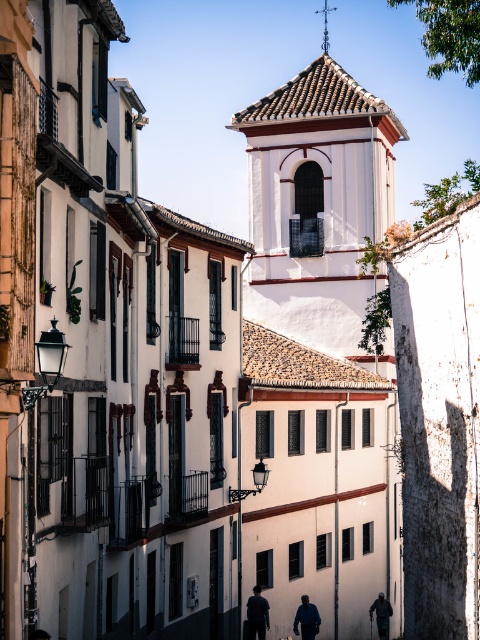
Is white textured tower at center to the right of dark blue jacket at center from the viewer's perspective?

Indeed, white textured tower at center is positioned on the right side of dark blue jacket at center.

Is white textured tower at center wider than dark blue jacket at center?

Yes.

The height and width of the screenshot is (640, 480). Find the location of `white textured tower at center`. white textured tower at center is located at coordinates (321, 346).

Which is above, dark blue fabric at center or dark blue jacket at center?

dark blue fabric at center is higher up.

Can you confirm if dark blue fabric at center is smaller than dark blue jacket at center?

Incorrect, dark blue fabric at center is not smaller in size than dark blue jacket at center.

Image resolution: width=480 pixels, height=640 pixels. Describe the element at coordinates (256, 614) in the screenshot. I see `dark blue fabric at center` at that location.

This screenshot has height=640, width=480. Identify the location of dark blue fabric at center. (256, 614).

Does white textured tower at center appear under dark blue fabric at center?

Actually, white textured tower at center is above dark blue fabric at center.

In the scene shown: Can you confirm if white textured tower at center is wider than dark blue fabric at center?

Indeed, white textured tower at center has a greater width compared to dark blue fabric at center.

Is point (248, 353) positioned after point (259, 602)?

That is True.

Find the location of `white textured tower at center`. white textured tower at center is located at coordinates (321, 346).